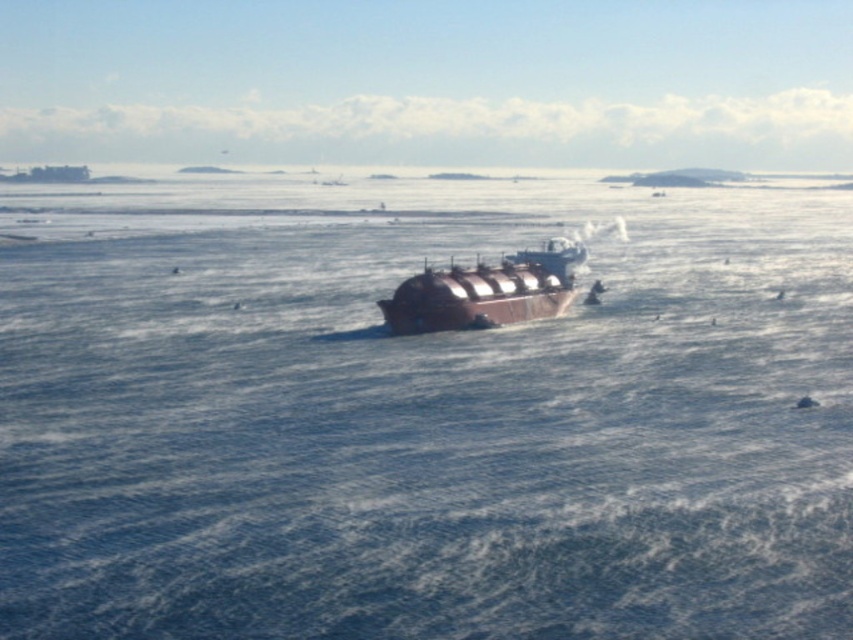
You are a marine biologist observing the ship and its surroundings. You notice the brown metallic water at center and the brown matte tanker at center. Which one has a larger surface area?

The brown metallic water at center has a larger surface area than the brown matte tanker at center according to the description.